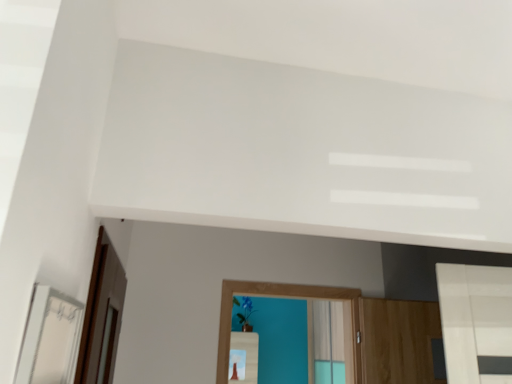
Question: From their relative heights in the image, would you say white glossy mirror at left is taller or shorter than brown wooden screen door at left?

Choices:
 (A) short
 (B) tall

Answer: (A)

Question: Choose the correct answer: Is white glossy mirror at left inside brown wooden screen door at left or outside it?

Choices:
 (A) inside
 (B) outside

Answer: (B)

Question: In the image, is white glossy mirror at left positioned in front of or behind brown wooden screen door at left?

Choices:
 (A) front
 (B) behind

Answer: (A)

Question: From the image's perspective, relative to white glossy mirror at left, is brown wooden screen door at left above or below?

Choices:
 (A) below
 (B) above

Answer: (A)

Question: In terms of width, does brown wooden screen door at left look wider or thinner when compared to white glossy mirror at left?

Choices:
 (A) wide
 (B) thin

Answer: (A)

Question: Is point (88, 382) closer or farther from the camera than point (53, 311)?

Choices:
 (A) farther
 (B) closer

Answer: (A)

Question: Choose the correct answer: Is brown wooden screen door at left inside white glossy mirror at left or outside it?

Choices:
 (A) inside
 (B) outside

Answer: (B)